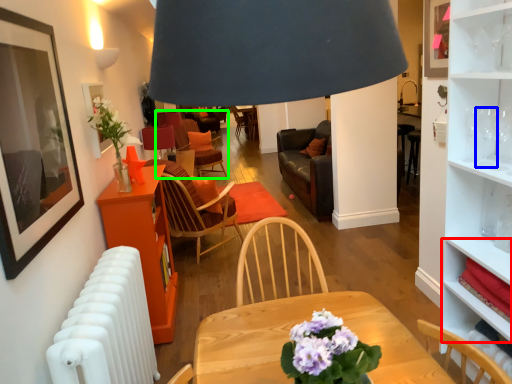
Question: Which object is positioned farthest from cabinet (highlighted by a red box)? Select from wine glass (highlighted by a blue box) and chair (highlighted by a green box).

Choices:
 (A) wine glass
 (B) chair

Answer: (B)